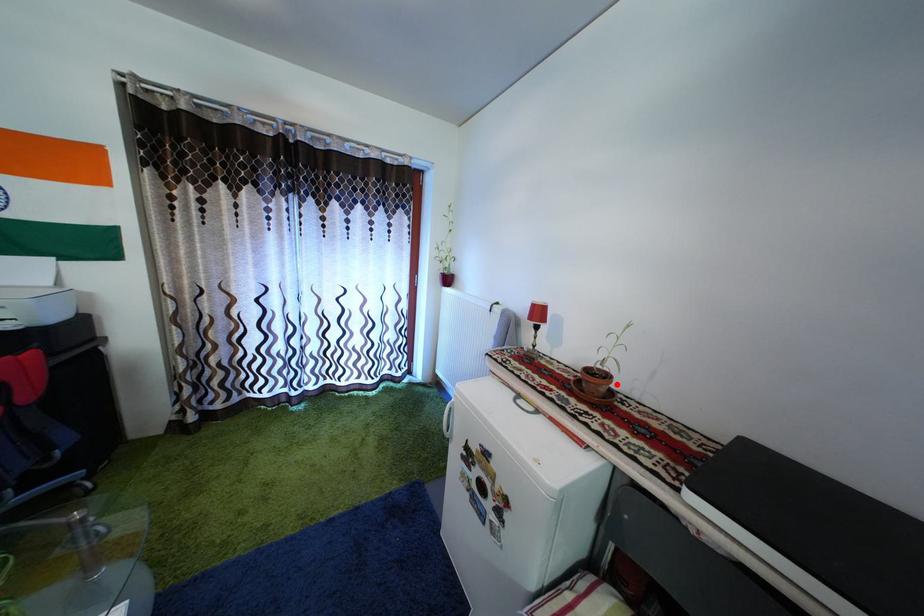
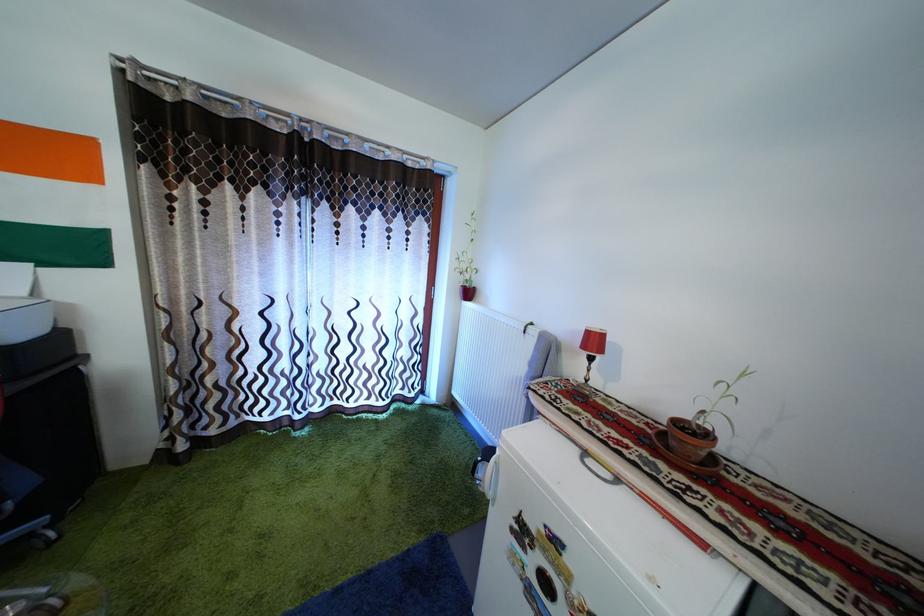
The point at the highlighted location is marked in the first image. Where is the corresponding point in the second image?

(715, 442)